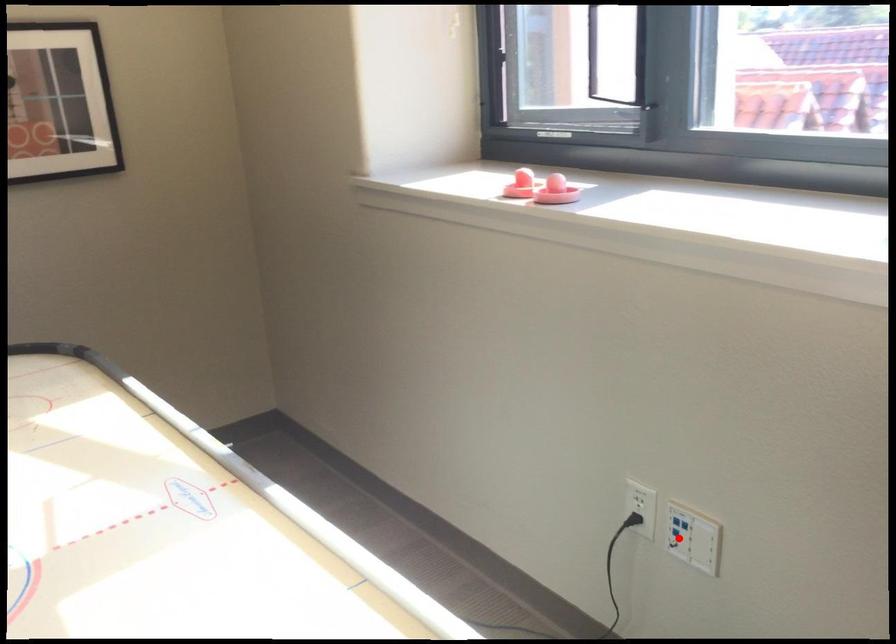
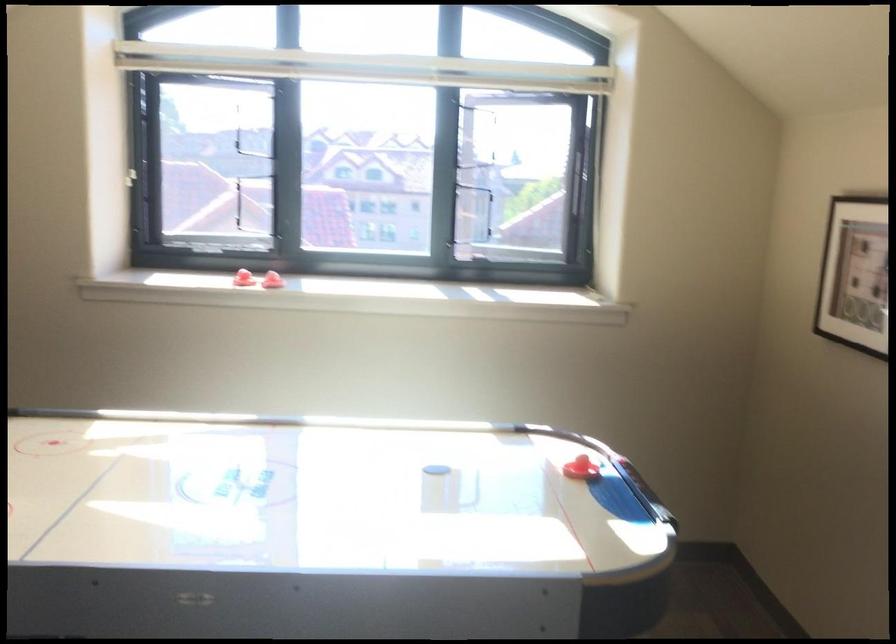
Question: I am providing you with two images of the same scene from different viewpoints. A red point is marked on the first image. At the location where the point appears in image 1, is it still visible in image 2?

Choices:
 (A) Yes
 (B) No

Answer: (B)